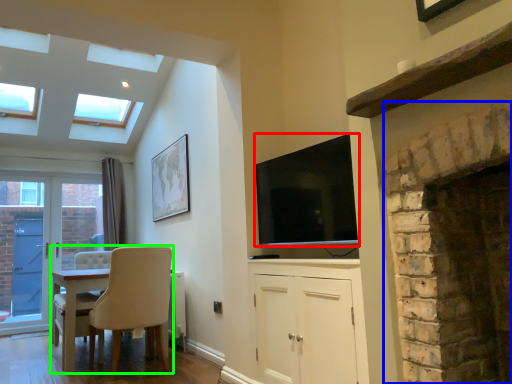
Question: Considering the real-world distances, which object is farthest from television (highlighted by a red box)? fireplace (highlighted by a blue box) or chair (highlighted by a green box)?

Choices:
 (A) fireplace
 (B) chair

Answer: (B)